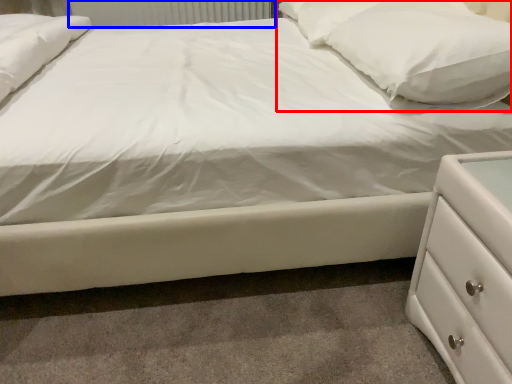
Question: Which of the following is the farthest to the observer, pillow (highlighted by a red box) or radiator (highlighted by a blue box)?

Choices:
 (A) pillow
 (B) radiator

Answer: (B)